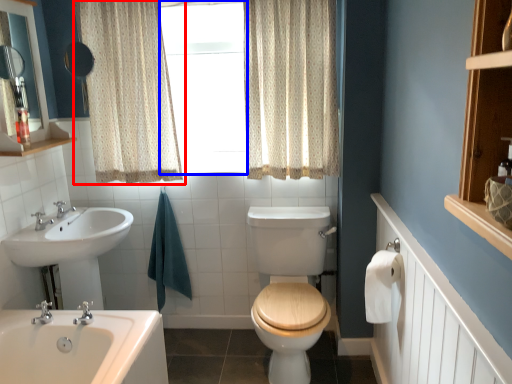
Question: Which object is closer to the camera taking this photo, curtain (highlighted by a red box) or window frame (highlighted by a blue box)?

Choices:
 (A) curtain
 (B) window frame

Answer: (A)